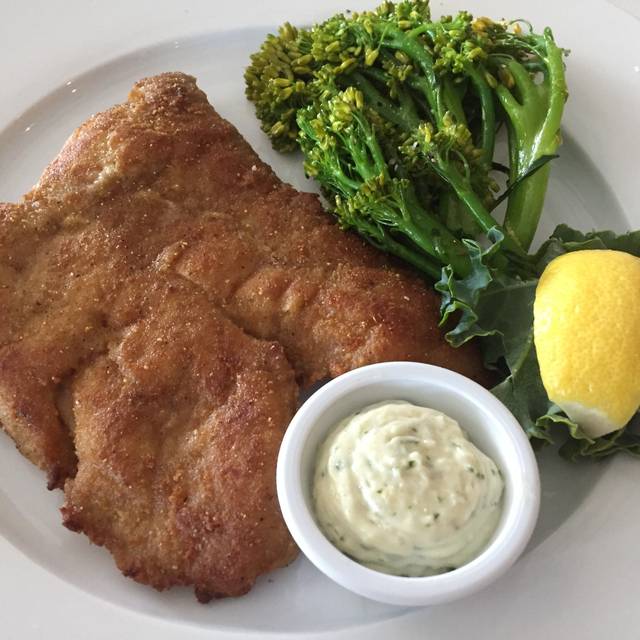
The height and width of the screenshot is (640, 640). I want to click on edge of dinner plate, so click(67, 585).